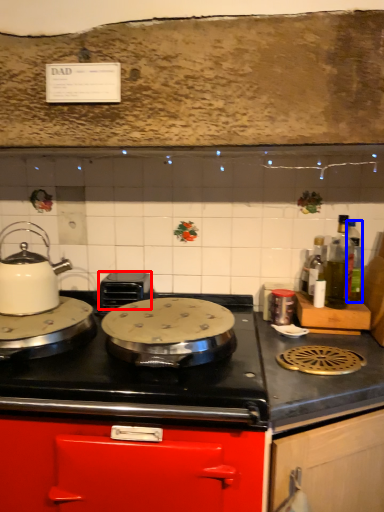
Question: Which point is further to the camera, appliance (highlighted by a red box) or bottle (highlighted by a blue box)?

Choices:
 (A) appliance
 (B) bottle

Answer: (A)